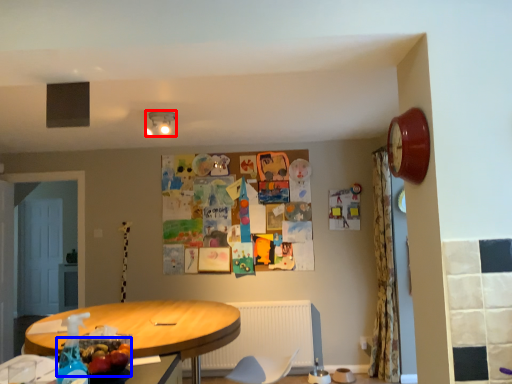
Question: Among these objects, which one is farthest to the camera, lamp (highlighted by a red box) or food (highlighted by a blue box)?

Choices:
 (A) lamp
 (B) food

Answer: (A)